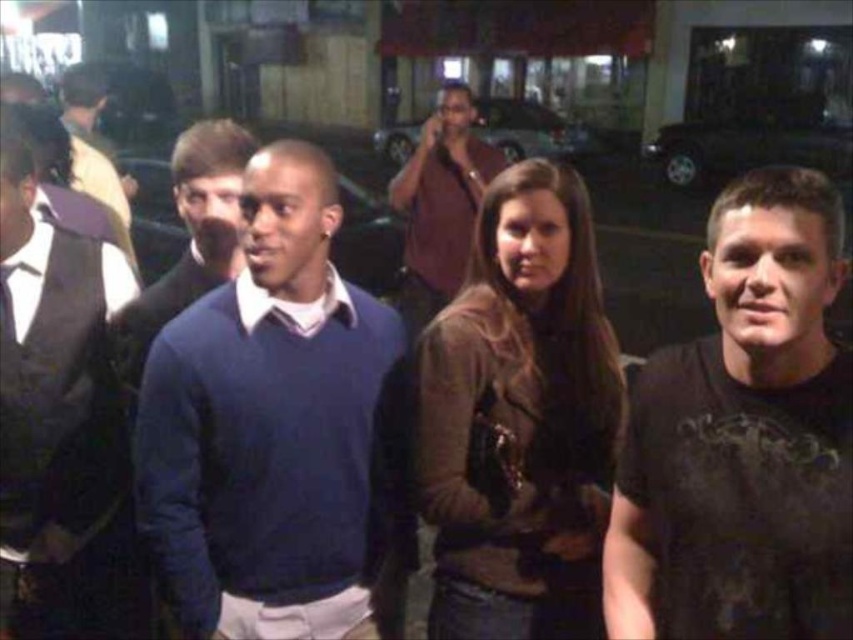
Please describe the exact position of the brown leather jacket at center in the image using coordinates. The answer should include the coordinates provided in the Objects Description.

The brown leather jacket at center is located at coordinates point (x=521, y=417).

You are standing at the origin point in the image and want to locate the brown leather jacket at center. Which direction should you move to reach it?

The brown leather jacket at center is located at coordinate point 0.653 on the x axis and 0.612 on the y axis. Since you are at the origin point, you should move towards the right and forward to reach it.